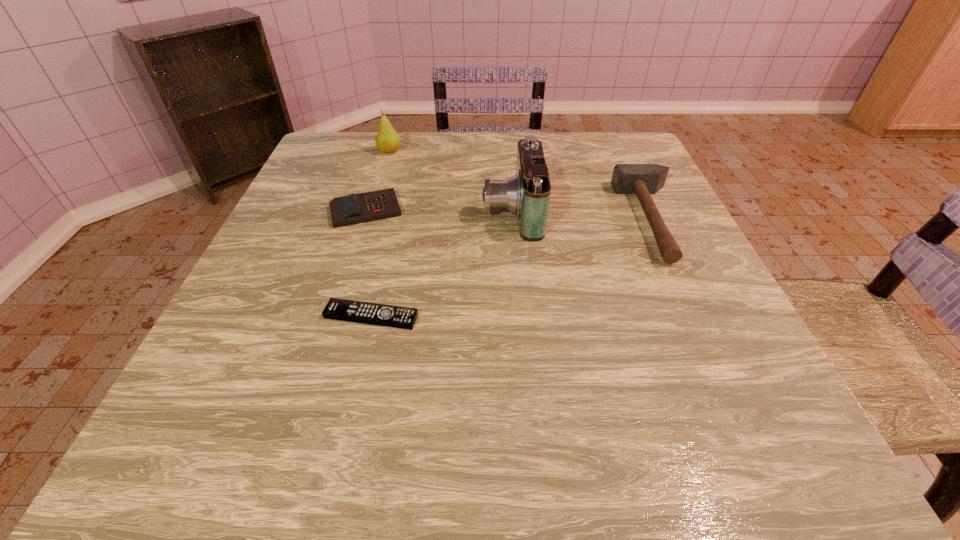
I want to click on the second object from right to left, so click(x=527, y=194).

Identify the location of the farthest object. The image size is (960, 540). (387, 140).

The image size is (960, 540). I want to click on the rightmost object, so click(x=641, y=179).

Locate an element on the screen. the third shortest object is located at coordinates (641, 179).

You are a GUI agent. You are given a task and a screenshot of the screen. Output one action in this format:
    pyautogui.click(x=<x>, y=<y>)
    Task: Click on the calculator
    The image size is (960, 540).
    Given the screenshot: What is the action you would take?
    pyautogui.click(x=353, y=209)

Image resolution: width=960 pixels, height=540 pixels. Identify the location of the shortest object. (336, 309).

Identify the location of the nearest object. (336, 309).

The height and width of the screenshot is (540, 960). In order to click on free region located 0.310m on the front-facing side of the camcorder in this screenshot , I will do [x=344, y=210].

This screenshot has height=540, width=960. I want to click on free space located on the front-facing side of the camcorder, so click(x=393, y=210).

This screenshot has height=540, width=960. Identify the location of vacant space located 0.130m on the front-facing side of the camcorder. (424, 210).